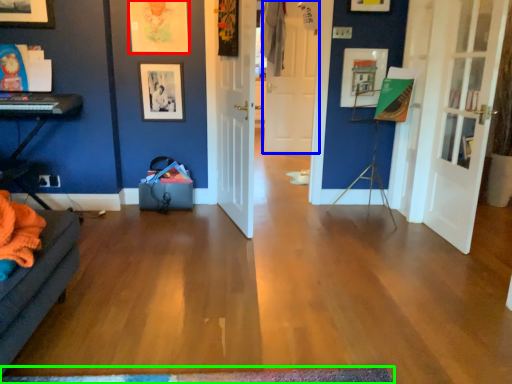
Question: Which is farther away from picture frame (highlighted by a red box)? door (highlighted by a blue box) or doormat (highlighted by a green box)?

Choices:
 (A) door
 (B) doormat

Answer: (A)